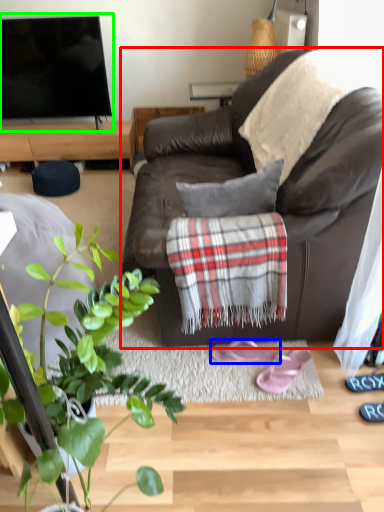
Question: Which is nearer to the studio couch (highlighted by a red box)? footwear (highlighted by a blue box) or television (highlighted by a green box).

Choices:
 (A) footwear
 (B) television

Answer: (A)